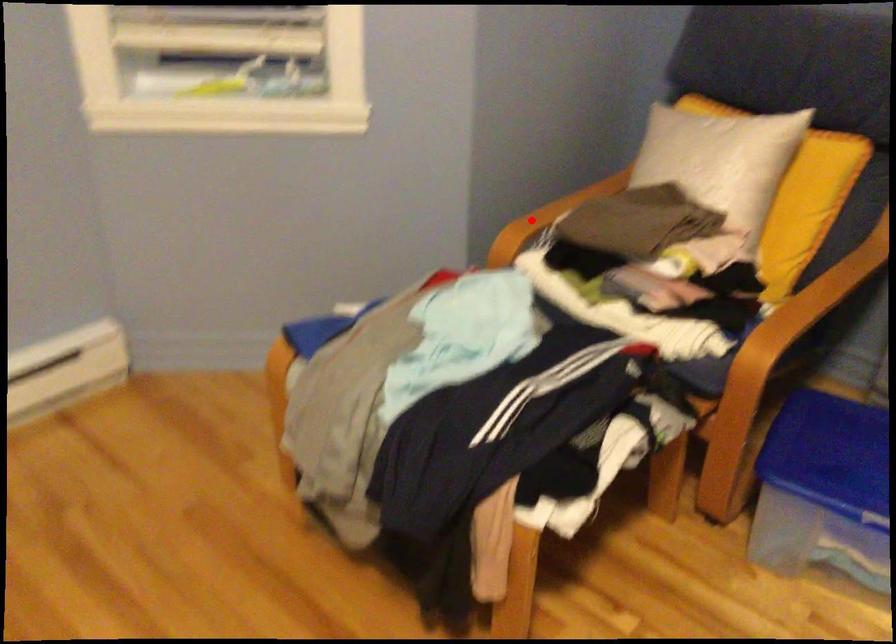
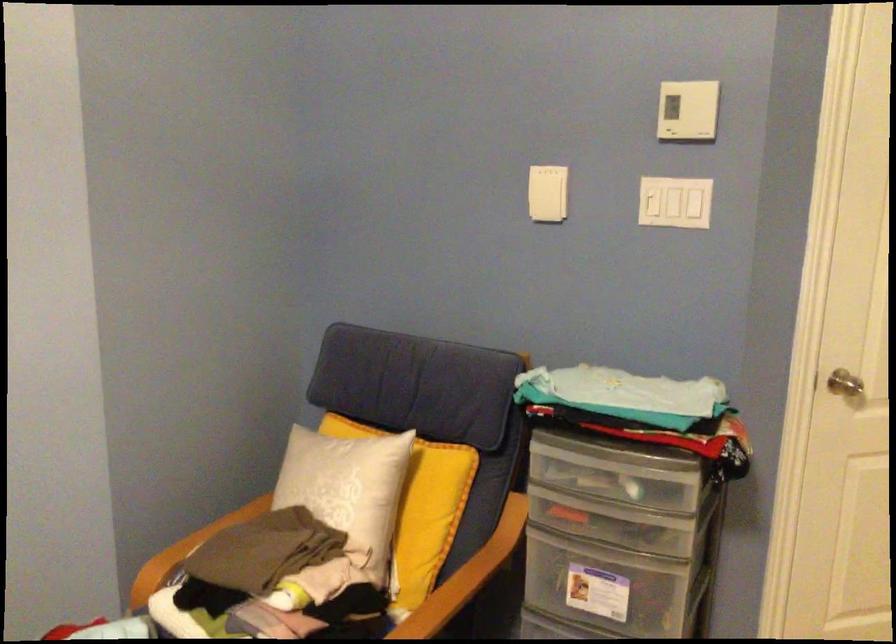
Find the pixel in the second image that matches the highlighted location in the first image.

(178, 551)